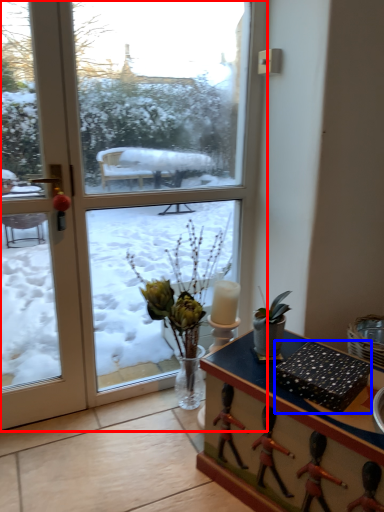
Question: Which point is further to the camera, window (highlighted by a red box) or box (highlighted by a blue box)?

Choices:
 (A) window
 (B) box

Answer: (A)